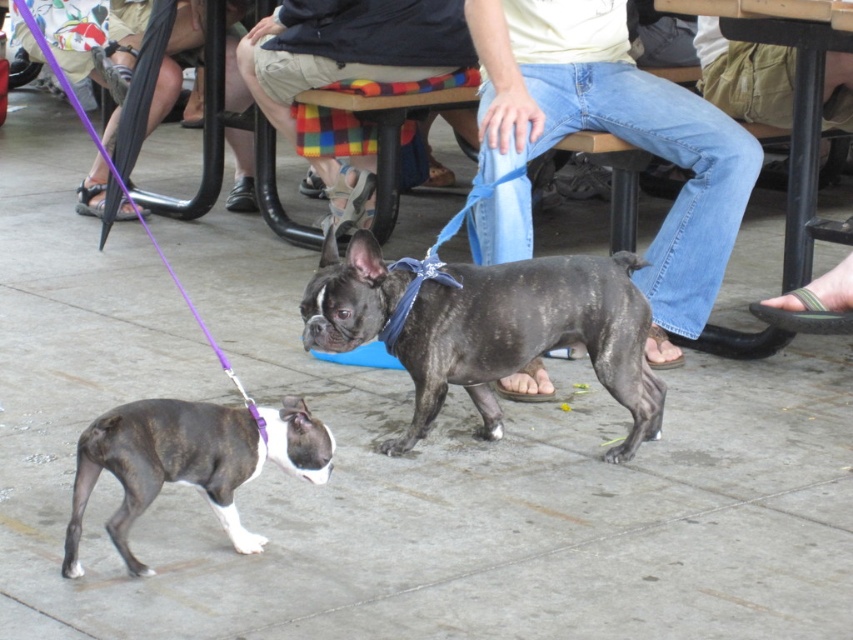
Is denim jeans at center to the left of brindle fur dog at lower left from the viewer's perspective?

No, denim jeans at center is not to the left of brindle fur dog at lower left.

Between denim jeans at center and brindle fur dog at lower left, which one is positioned higher?

denim jeans at center

Where is `denim jeans at center`? The width and height of the screenshot is (853, 640). denim jeans at center is located at coordinates (618, 134).

Is point (113, 436) farther from viewer compared to point (177, 44)?

No, (113, 436) is in front of (177, 44).

Which is more to the left, brindle fur dog at lower left or purple fabric leash at upper left?

Positioned to the left is purple fabric leash at upper left.

You are a GUI agent. You are given a task and a screenshot of the screen. Output one action in this format:
    pyautogui.click(x=<x>, y=<y>)
    Task: Click on the brindle fur dog at lower left
    
    Given the screenshot: What is the action you would take?
    pyautogui.click(x=189, y=461)

The image size is (853, 640). What are the coordinates of `brindle fur dog at lower left` in the screenshot? It's located at (189, 461).

Is light beige shorts at center above purple fabric leash at upper left?

Actually, light beige shorts at center is below purple fabric leash at upper left.

The image size is (853, 640). Describe the element at coordinates (347, 48) in the screenshot. I see `light beige shorts at center` at that location.

Where is `light beige shorts at center`? light beige shorts at center is located at coordinates (347, 48).